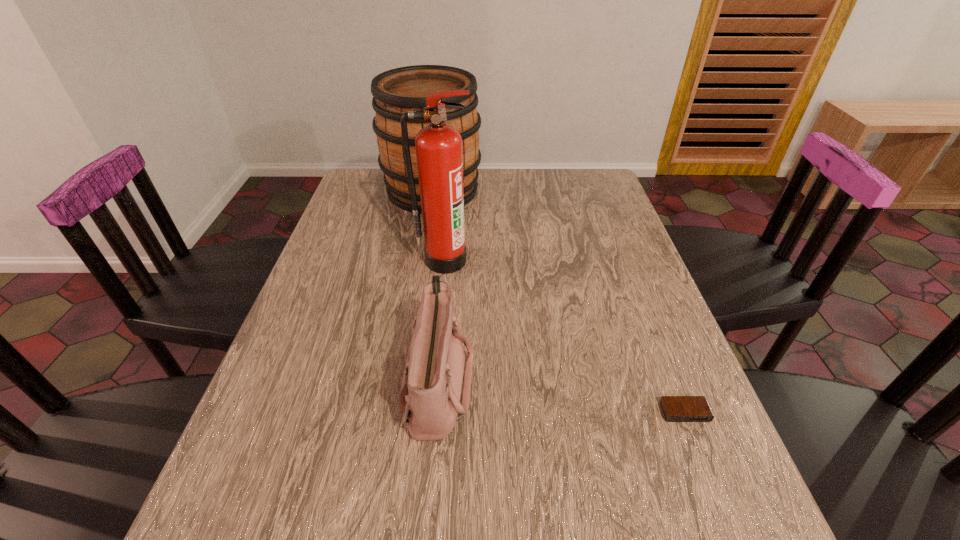
The height and width of the screenshot is (540, 960). I want to click on the third nearest object, so click(439, 155).

I want to click on fire extinguisher, so click(439, 155).

In order to click on the third shortest object in this screenshot , I will do `click(397, 91)`.

The height and width of the screenshot is (540, 960). In order to click on the farthest object in this screenshot , I will do `click(397, 91)`.

Locate an element on the screen. The width and height of the screenshot is (960, 540). shoulder bag is located at coordinates (435, 393).

I want to click on the rightmost object, so click(x=675, y=408).

The height and width of the screenshot is (540, 960). I want to click on alarm clock, so click(x=675, y=408).

Image resolution: width=960 pixels, height=540 pixels. In order to click on free spot located with the nozzle pointing from the back of the fire extinguisher in this screenshot , I will do `click(435, 353)`.

Find the location of a particular element. Image resolution: width=960 pixels, height=540 pixels. blank area located 0.160m on the front of the farthest object is located at coordinates (423, 249).

Where is `vacant space located 0.220m on the front pocket of the third tallest object`? The width and height of the screenshot is (960, 540). vacant space located 0.220m on the front pocket of the third tallest object is located at coordinates (583, 381).